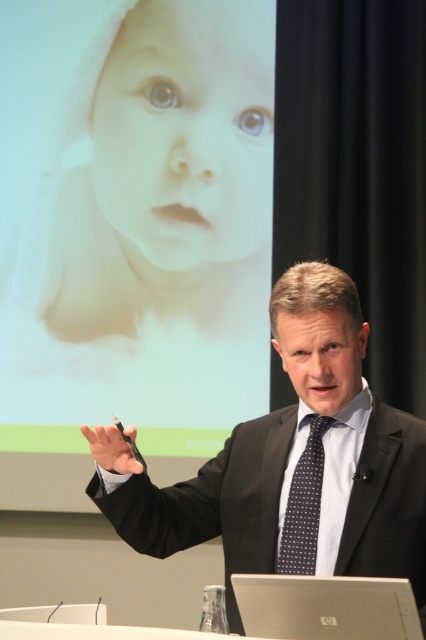
You are an attendee at the presentation. You notice the smooth white baby at upper left and the black suit at center. Which object is positioned higher in the image?

The smooth white baby at upper left is positioned higher than the black suit at center.

You are sitting in the audience of this presentation. You notice two points on the projection screen. One is at coordinates point (396,616) and the other is at point (307,417). Which point is closer to you?

Point (396,616) is in front of point (307,417), so it is closer to you.

You are an attendee in the conference room. You want to take a photo of the black suit at center without the smooth white baby at upper left appearing in the frame. Is it possible given their positions?

The smooth white baby at upper left is further to the viewer than the black suit at center, so it is blocking the view. Therefore, you cannot take a photo of the black suit at center without the smooth white baby at upper left appearing in the frame.